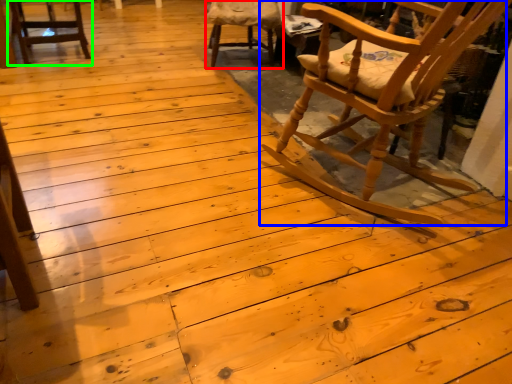
Question: Estimate the real-world distances between objects in this image. Which object is closer to chair (highlighted by a red box), chair (highlighted by a blue box) or chair (highlighted by a green box)?

Choices:
 (A) chair
 (B) chair

Answer: (B)